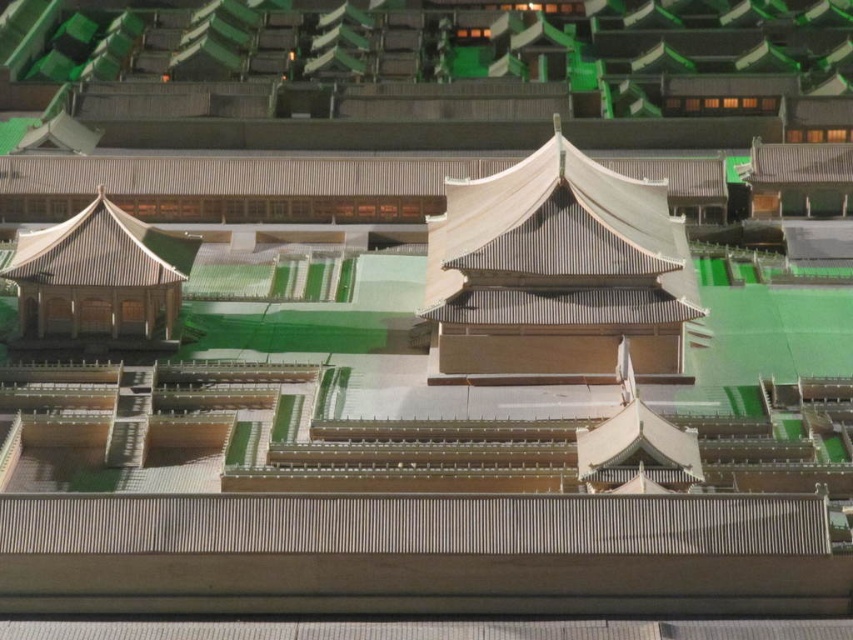
Question: Can you confirm if matte gray roof at center is positioned above matte brown gazebo at left?

Choices:
 (A) yes
 (B) no

Answer: (A)

Question: Where is matte gray roof at center located in relation to matte brown gazebo at left in the image?

Choices:
 (A) left
 (B) right

Answer: (B)

Question: Which of the following is the closest to the observer?

Choices:
 (A) matte brown gazebo at left
 (B) matte gray roof at center

Answer: (B)

Question: Does matte gray roof at center have a smaller size compared to matte brown gazebo at left?

Choices:
 (A) yes
 (B) no

Answer: (B)